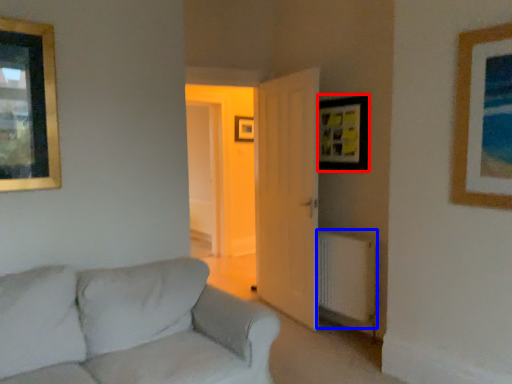
Question: Which object is further to the camera taking this photo, picture frame (highlighted by a red box) or radiator (highlighted by a blue box)?

Choices:
 (A) picture frame
 (B) radiator

Answer: (A)